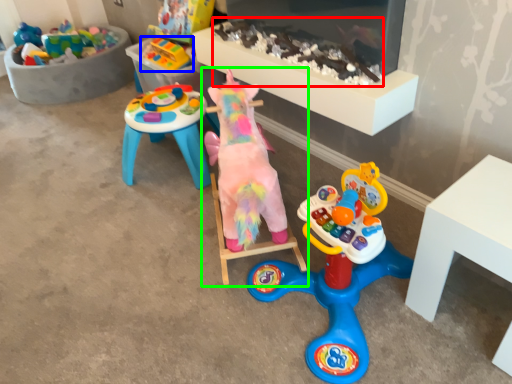
Question: Which is nearer to the toy (highlighted by a red box)? toy (highlighted by a blue box) or toy (highlighted by a green box).

Choices:
 (A) toy
 (B) toy

Answer: (B)